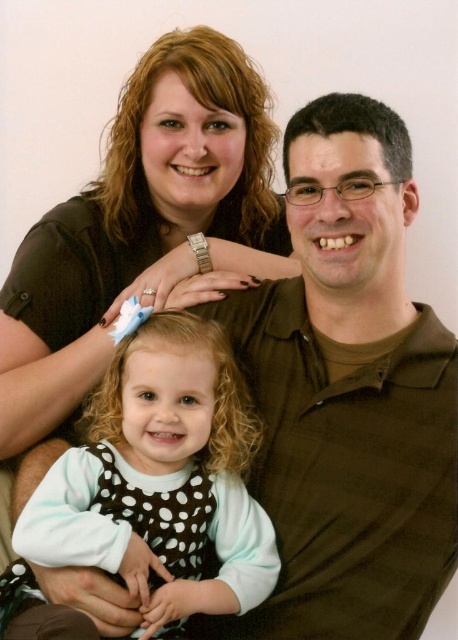
Does point (256, 128) come closer to viewer compared to point (266, 593)?

No, it is not.

Can you confirm if matte black shirt at upper left is wider than white dotted dress at center?

Correct, the width of matte black shirt at upper left exceeds that of white dotted dress at center.

The width and height of the screenshot is (458, 640). What are the coordinates of `matte black shirt at upper left` in the screenshot? It's located at (143, 227).